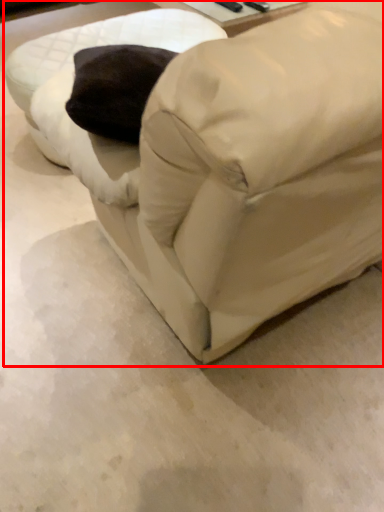
Question: Considering the relative positions of furniture (annotated by the red box) and swivel chair in the image provided, where is furniture (annotated by the red box) located with respect to the staircase?

Choices:
 (A) left
 (B) right

Answer: (B)